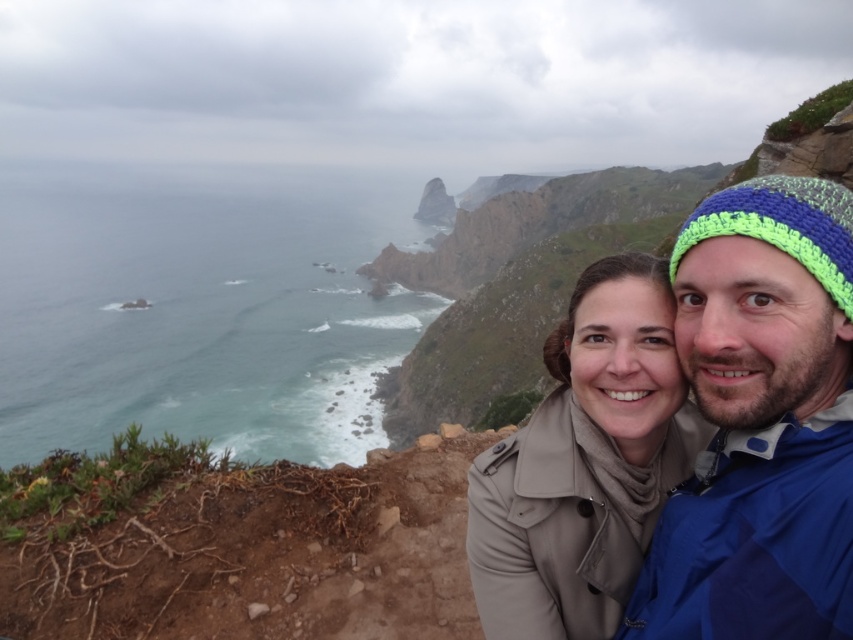
You are a photographer planning to take a photo of the blue knitted beanie at right and the beige fabric coat at center. If you want to ensure both items are clearly visible in the frame, which one should you focus on first considering their sizes?

The blue knitted beanie at right is smaller in width than the beige fabric coat at center, so you should focus on the beige fabric coat at center first to ensure it is clearly visible, then adjust for the smaller beanie.

You are a photographer trying to capture a photo of the blue knitted beanie at right and the beige fabric coat at center. Based on their heights, which object should you focus on first if you want to ensure both are in frame without adjusting your camera angle?

The blue knitted beanie at right is not as tall as the beige fabric coat at center, so you should focus on the beige fabric coat at center first to ensure both are in frame.

You are a photographer planning to capture the scenic coastal landscape with the two individuals. Based on the image, where is the blue knitted beanie at right in relation to the beige fabric coat at center?

The blue knitted beanie at right is above the beige fabric coat at center.